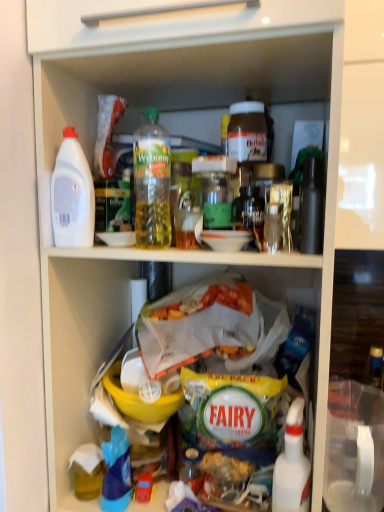
Image resolution: width=384 pixels, height=512 pixels. What do you see at coordinates (292, 466) in the screenshot?
I see `white plastic spray bottle at lower right, positioned as the fifth bottle in left-to-right order` at bounding box center [292, 466].

The width and height of the screenshot is (384, 512). Find the location of `white plastic spray bottle at lower right, the first bottle in the right-to-left sequence`. white plastic spray bottle at lower right, the first bottle in the right-to-left sequence is located at coordinates coord(292,466).

This screenshot has width=384, height=512. Identify the location of translucent plastic bottle at upper center, which is counted as the 2th bottle, starting from the left. (152, 182).

This screenshot has width=384, height=512. Describe the element at coordinates (215, 189) in the screenshot. I see `green glass jar at center, which is the third bottle in right-to-left order` at that location.

In the scene shown: How much space does matte brown jar at upper center, positioned as the 2th bottle in right-to-left order, occupy horizontally?

matte brown jar at upper center, positioned as the 2th bottle in right-to-left order, is 8.29 inches wide.

Where is `blue plastic bottle at lower left`? The width and height of the screenshot is (384, 512). blue plastic bottle at lower left is located at coordinates (116, 472).

From a real-world perspective, which object stands above the other?

matte brown jar at upper center, which is the fourth bottle in left-to-right order, from a real-world perspective.

Would you say matte brown jar at upper center, which is the fourth bottle in left-to-right order, is outside blue plastic bottle at lower left?

That's correct, matte brown jar at upper center, which is the fourth bottle in left-to-right order, is outside of blue plastic bottle at lower left.

Find the location of `bottle that is the 3rd one when counting rightward from the blue plastic bottle at lower left`. bottle that is the 3rd one when counting rightward from the blue plastic bottle at lower left is located at coordinates (247, 132).

Is blue plastic bottle at lower left at the back of matte brown jar at upper center, which is the fourth bottle in left-to-right order?

Result: No, matte brown jar at upper center, which is the fourth bottle in left-to-right order, is not facing the opposite direction of blue plastic bottle at lower left.

Identify the location of bottle that is the 1st object to the right of the yellow plastic bowl at center, starting at the anchor. (152, 182).

Can you tell me how much yellow plastic bowl at center and translucent plastic bottle at upper center, the fourth bottle viewed from the right, differ in facing direction?

0.000307 degrees.

From the image's perspective, is yellow plastic bowl at center over translucent plastic bottle at upper center, which is counted as the 2th bottle, starting from the left?

Actually, yellow plastic bowl at center appears below translucent plastic bottle at upper center, which is counted as the 2th bottle, starting from the left, in the image.

Does yellow plastic bowl at center touch white plastic spray bottle at lower right, the first bottle in the right-to-left sequence?

No, yellow plastic bowl at center is not beside white plastic spray bottle at lower right, the first bottle in the right-to-left sequence.

What's the angular difference between yellow plastic bowl at center and white plastic spray bottle at lower right, the first bottle in the right-to-left sequence,'s facing directions?

The angular difference between yellow plastic bowl at center and white plastic spray bottle at lower right, the first bottle in the right-to-left sequence, is 0.364 degrees.

Which bottle is the 5th one when counting from the front of the yellow plastic bowl at center? Please provide its 2D coordinates.

[(292, 466)]

From the image's perspective, would you say yellow plastic bowl at center is positioned over white plastic spray bottle at lower right, positioned as the fifth bottle in left-to-right order?

Yes, from the image's perspective, yellow plastic bowl at center is on top of white plastic spray bottle at lower right, positioned as the fifth bottle in left-to-right order.

Which is behind, white plastic spray bottle at lower right, the first bottle in the right-to-left sequence, or yellow plastic bowl at center?

yellow plastic bowl at center.

Would you say white plastic spray bottle at lower right, the first bottle in the right-to-left sequence, is to the left or to the right of yellow plastic bowl at center in the picture?

Clearly, white plastic spray bottle at lower right, the first bottle in the right-to-left sequence, is on the right of yellow plastic bowl at center in the image.

From the image's perspective, is white plastic spray bottle at lower right, the first bottle in the right-to-left sequence, positioned above or below yellow plastic bowl at center?

white plastic spray bottle at lower right, the first bottle in the right-to-left sequence, is below yellow plastic bowl at center.

From the picture: Between white plastic spray bottle at lower right, the first bottle in the right-to-left sequence, and yellow plastic bowl at center, which one has more height?

white plastic spray bottle at lower right, the first bottle in the right-to-left sequence.

Image resolution: width=384 pixels, height=512 pixels. I want to click on the 3rd bottle above the green glass jar at center, positioned as the 3th bottle in left-to-right order (from the image's perspective), so click(247, 132).

Measure the distance from green glass jar at center, which is the third bottle in right-to-left order, to matte brown jar at upper center, which is the fourth bottle in left-to-right order.

12.96 centimeters.

Which object is positioned more to the left, green glass jar at center, which is the third bottle in right-to-left order, or matte brown jar at upper center, which is the fourth bottle in left-to-right order?

green glass jar at center, which is the third bottle in right-to-left order.

Consider the image. From the image's perspective, is green glass jar at center, which is the third bottle in right-to-left order, located above or below matte brown jar at upper center, positioned as the 2th bottle in right-to-left order?

green glass jar at center, which is the third bottle in right-to-left order, is below matte brown jar at upper center, positioned as the 2th bottle in right-to-left order.

Is white plastic bottle at left, which ranks as the 1th bottle in left-to-right order, bigger than green glass jar at center, which is the third bottle in right-to-left order?

Actually, white plastic bottle at left, which ranks as the 1th bottle in left-to-right order, might be smaller than green glass jar at center, which is the third bottle in right-to-left order.

From a real-world perspective, is white plastic bottle at left, the 5th bottle when ordered from right to left, physically below green glass jar at center, which is the third bottle in right-to-left order?

Incorrect, from a real-world perspective, white plastic bottle at left, the 5th bottle when ordered from right to left, is higher than green glass jar at center, which is the third bottle in right-to-left order.

Consider the image. From the image's perspective, is white plastic bottle at left, the 5th bottle when ordered from right to left, above or below green glass jar at center, positioned as the 3th bottle in left-to-right order?

From the image's perspective, white plastic bottle at left, the 5th bottle when ordered from right to left, appears above green glass jar at center, positioned as the 3th bottle in left-to-right order.

Find the location of a particular element. This screenshot has width=384, height=512. the 1st bottle in front of the green glass jar at center, which is the third bottle in right-to-left order is located at coordinates (72, 195).

From a real-world perspective, is white plastic bottle at left, the 5th bottle when ordered from right to left, over blue plastic bottle at lower left?

Indeed, from a real-world perspective, white plastic bottle at left, the 5th bottle when ordered from right to left, stands above blue plastic bottle at lower left.

Which is more to the left, white plastic bottle at left, which ranks as the 1th bottle in left-to-right order, or blue plastic bottle at lower left?

From the viewer's perspective, white plastic bottle at left, which ranks as the 1th bottle in left-to-right order, appears more on the left side.

From the image's perspective, between white plastic bottle at left, which ranks as the 1th bottle in left-to-right order, and blue plastic bottle at lower left, who is located below?

blue plastic bottle at lower left, from the image's perspective.

Is white plastic bottle at left, the 5th bottle when ordered from right to left, located outside blue plastic bottle at lower left?

Absolutely, white plastic bottle at left, the 5th bottle when ordered from right to left, is external to blue plastic bottle at lower left.

Where is `cleaning product lying on the left of matte brown jar at upper center, positioned as the 2th bottle in right-to-left order`? This screenshot has width=384, height=512. cleaning product lying on the left of matte brown jar at upper center, positioned as the 2th bottle in right-to-left order is located at coordinates (116, 472).

Locate an element on the screen. bottle that is the 1st object to the right of the yellow plastic bowl at center, starting at the anchor is located at coordinates coord(152,182).

Considering their positions, is white plastic bottle at left, which ranks as the 1th bottle in left-to-right order, positioned closer to green glass jar at center, which is the third bottle in right-to-left order, than white plastic spray bottle at lower right, the first bottle in the right-to-left sequence?

white plastic bottle at left, which ranks as the 1th bottle in left-to-right order.

Considering their positions, is translucent plastic bottle at upper center, the fourth bottle viewed from the right, positioned further to blue plastic bottle at lower left than matte brown jar at upper center, which is the fourth bottle in left-to-right order?

matte brown jar at upper center, which is the fourth bottle in left-to-right order, lies further to blue plastic bottle at lower left than the other object.

Considering their positions, is matte brown jar at upper center, positioned as the 2th bottle in right-to-left order, positioned closer to blue plastic bottle at lower left than translucent plastic bottle at upper center, the fourth bottle viewed from the right?

translucent plastic bottle at upper center, the fourth bottle viewed from the right, lies closer to blue plastic bottle at lower left than the other object.

Which object lies nearer to the anchor point white plastic bottle at left, which ranks as the 1th bottle in left-to-right order, yellow plastic bowl at center or blue plastic bottle at lower left?

yellow plastic bowl at center is closer to white plastic bottle at left, which ranks as the 1th bottle in left-to-right order.

Looking at the image, which one is located closer to white plastic spray bottle at lower right, positioned as the fifth bottle in left-to-right order, green glass jar at center, positioned as the 3th bottle in left-to-right order, or blue plastic bottle at lower left?

blue plastic bottle at lower left.

From the image, which object appears to be farther from translucent plastic bottle at upper center, which is counted as the 2th bottle, starting from the left, white plastic bottle at left, which ranks as the 1th bottle in left-to-right order, or white plastic spray bottle at lower right, the first bottle in the right-to-left sequence?

white plastic spray bottle at lower right, the first bottle in the right-to-left sequence.

From the image, which object appears to be farther from green glass jar at center, which is the third bottle in right-to-left order, white plastic spray bottle at lower right, the first bottle in the right-to-left sequence, or blue plastic bottle at lower left?

blue plastic bottle at lower left is further to green glass jar at center, which is the third bottle in right-to-left order.

When comparing their distances from matte brown jar at upper center, which is the fourth bottle in left-to-right order, does blue plastic bottle at lower left or green glass jar at center, which is the third bottle in right-to-left order, seem closer?

green glass jar at center, which is the third bottle in right-to-left order, is closer to matte brown jar at upper center, which is the fourth bottle in left-to-right order.

I want to click on bottle situated between translucent plastic bottle at upper center, the fourth bottle viewed from the right, and matte brown jar at upper center, positioned as the 2th bottle in right-to-left order, from left to right, so click(215, 189).

At what (x,y) coordinates should I click in order to perform the action: click on bowl that lies between white plastic bottle at left, which ranks as the 1th bottle in left-to-right order, and white plastic spray bottle at lower right, positioned as the fifth bottle in left-to-right order, from top to bottom. Please return your answer as a coordinate pair (x, y). Image resolution: width=384 pixels, height=512 pixels. Looking at the image, I should click on (140, 400).

This screenshot has height=512, width=384. Find the location of `bottle between white plastic bottle at left, the 5th bottle when ordered from right to left, and green glass jar at center, positioned as the 3th bottle in left-to-right order`. bottle between white plastic bottle at left, the 5th bottle when ordered from right to left, and green glass jar at center, positioned as the 3th bottle in left-to-right order is located at coordinates (152, 182).

Find the location of `bowl between matte brown jar at upper center, positioned as the 2th bottle in right-to-left order, and blue plastic bottle at lower left in the up-down direction`. bowl between matte brown jar at upper center, positioned as the 2th bottle in right-to-left order, and blue plastic bottle at lower left in the up-down direction is located at coordinates (140, 400).